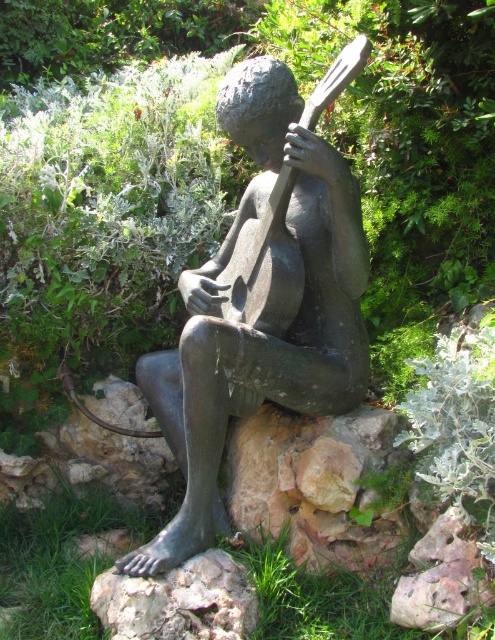
You are a tour guide explaining the sculpture garden to visitors. You need to mention the distance between the bronze statue at center and the bronze guitar at center. What do you tell them?

The bronze statue at center and the bronze guitar at center are 4.76 inches apart from each other.

You are standing in front of the sculpture and want to know which of the two points, point (262, 100) or point (208, 618), is closer to you. Can you determine this?

Point (262, 100) is further to the viewer than point (208, 618), so the closer point to you is point (208, 618).

You are a maintenance worker who needs to place a 32 inch long tool between the gray stone at lower center and the bronze guitar at center. Can you fit it there?

The distance between the gray stone at lower center and the bronze guitar at center is 32.67 inches, so the 32 inch long tool can fit there with a small amount of space remaining.